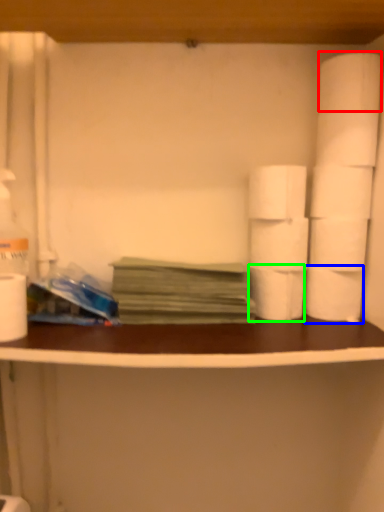
Question: Based on their relative distances, which object is farther from toilet paper (highlighted by a red box)? Choose from toilet paper (highlighted by a blue box) and toilet paper (highlighted by a green box).

Choices:
 (A) toilet paper
 (B) toilet paper

Answer: (B)